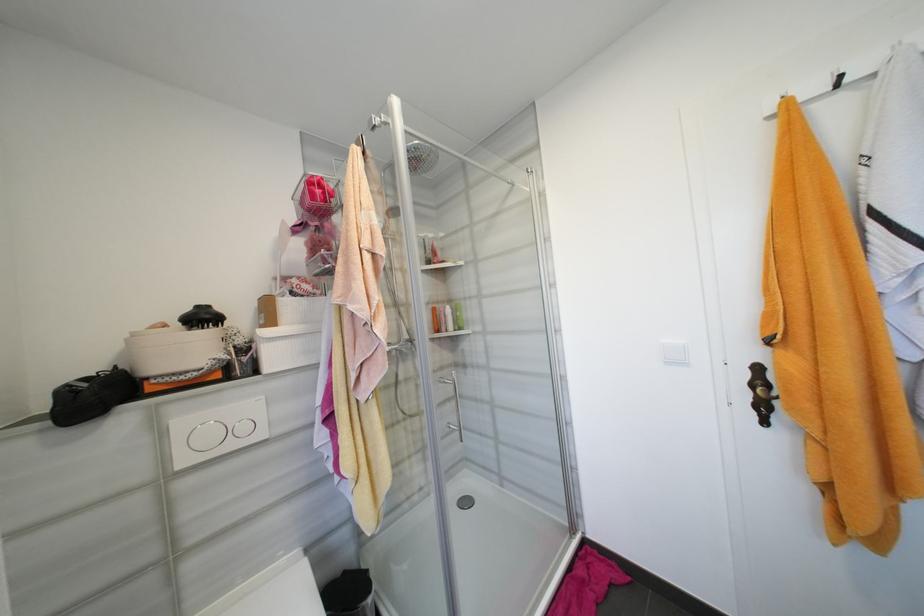
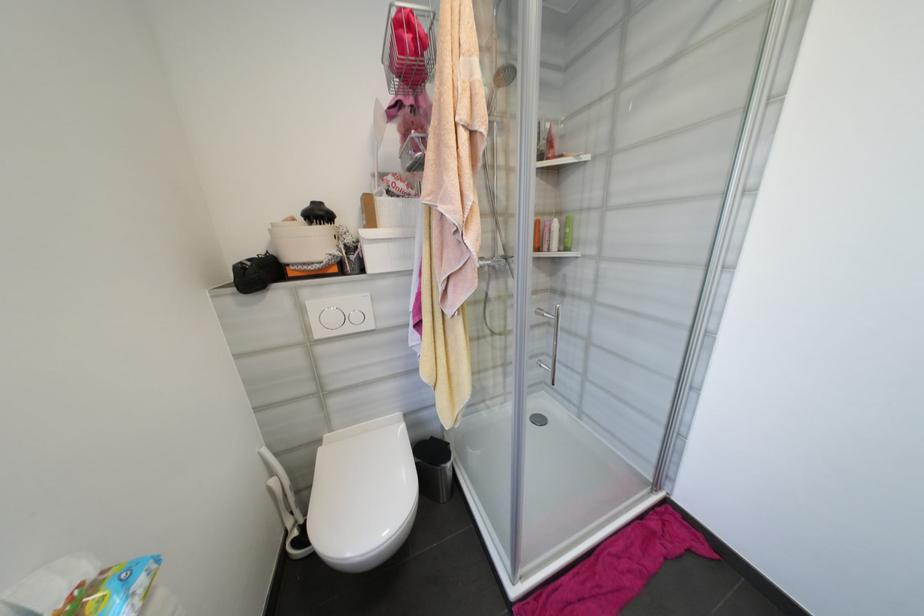
Where in the second image is the point corresponding to point 350,573 from the first image?

(438, 440)